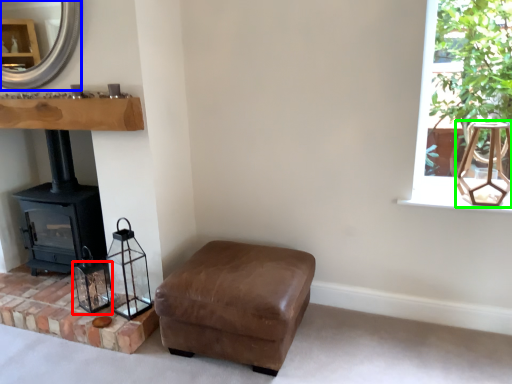
Question: Which object is the closest to the candle holder (highlighted by a red box)? Choose among these: fireplace (highlighted by a blue box) or lamp (highlighted by a green box).

Choices:
 (A) fireplace
 (B) lamp

Answer: (A)